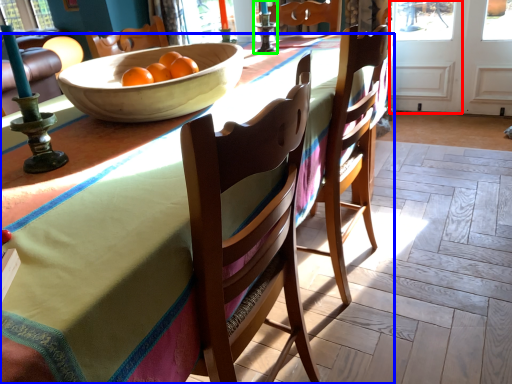
Question: Estimate the real-world distances between objects in this image. Which object is farther from screen door (highlighted by a red box), desk (highlighted by a blue box) or candle holder (highlighted by a green box)?

Choices:
 (A) desk
 (B) candle holder

Answer: (A)